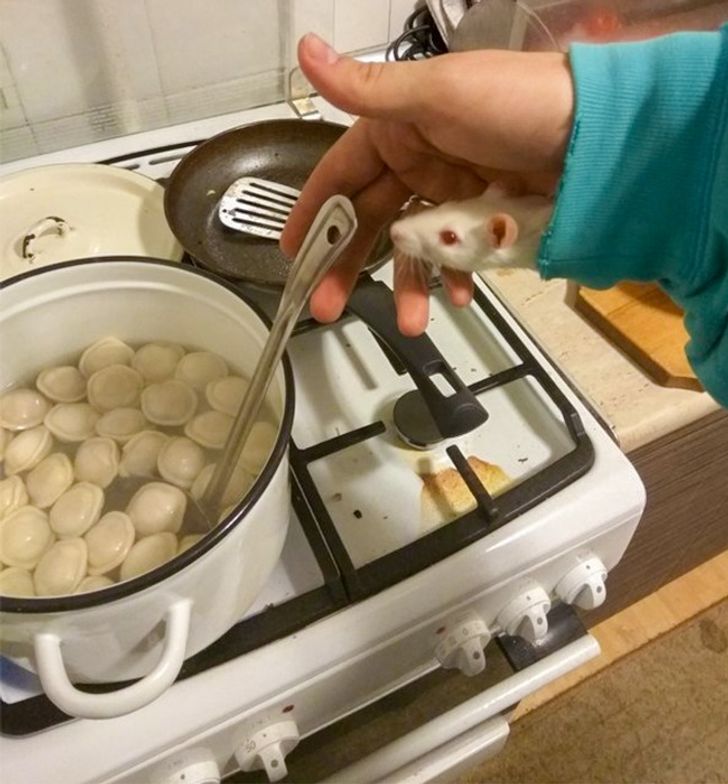
At what (x,y) coordinates should I click in order to perform the action: click on mouse. Please return your answer as a coordinate pair (x, y). The image size is (728, 784). Looking at the image, I should click on (454, 245).